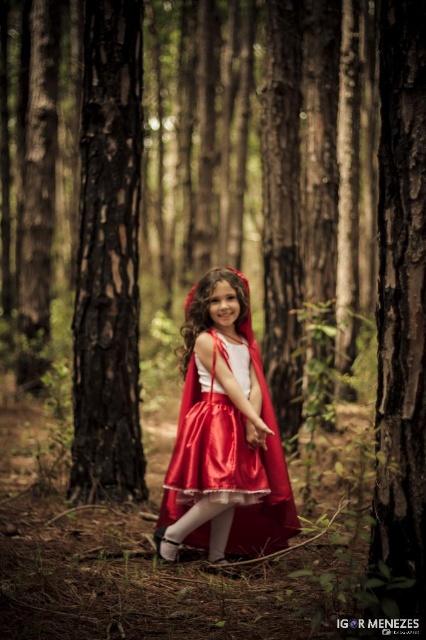
Does smooth dark brown bark at left appear on the right side of smooth bark tree at center?

No, smooth dark brown bark at left is not to the right of smooth bark tree at center.

Is the position of smooth dark brown bark at left more distant than that of smooth bark tree at center?

That is True.

Which is behind, point (92, 452) or point (422, 276)?

Positioned behind is point (92, 452).

The image size is (426, 640). I want to click on smooth dark brown bark at left, so 108,259.

Is point (88, 202) positioned before point (210, 364)?

That is False.

Does smooth dark brown bark at left come behind satin red cape at center?

Yes, it is behind satin red cape at center.

The height and width of the screenshot is (640, 426). What are the coordinates of `smooth dark brown bark at left` in the screenshot? It's located at click(108, 259).

Looking at this image, can you confirm if smooth bark tree at center is positioned below satin red cape at center?

Actually, smooth bark tree at center is above satin red cape at center.

Find the location of a particular element. smooth bark tree at center is located at coordinates (400, 308).

You are a GUI agent. You are given a task and a screenshot of the screen. Output one action in this format:
    pyautogui.click(x=<x>, y=<y>)
    Task: Click on the smooth bark tree at center
    
    Given the screenshot: What is the action you would take?
    pyautogui.click(x=400, y=308)

This screenshot has height=640, width=426. I want to click on smooth bark tree at center, so click(x=400, y=308).